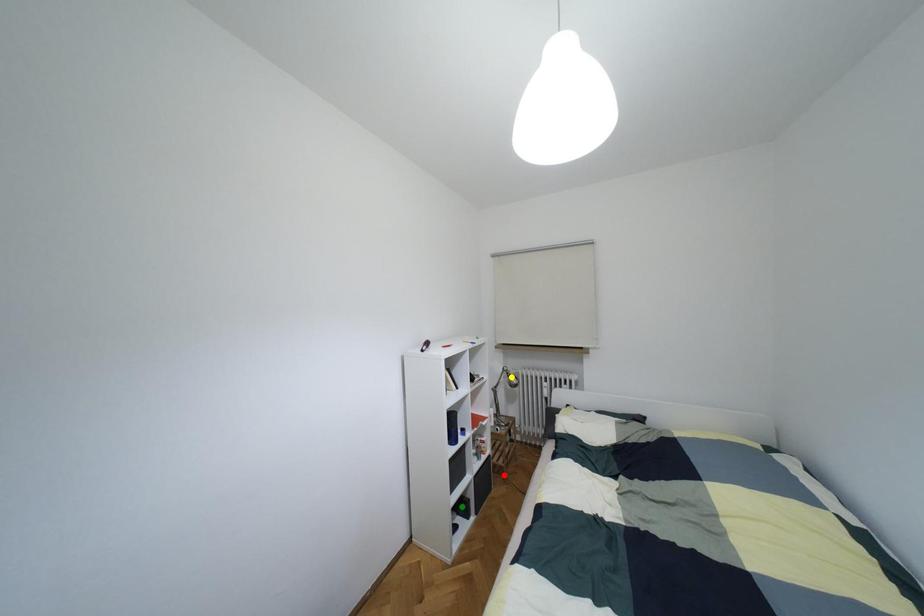
Order these from nearest to farthest:
- green point
- yellow point
- red point

yellow point < red point < green point